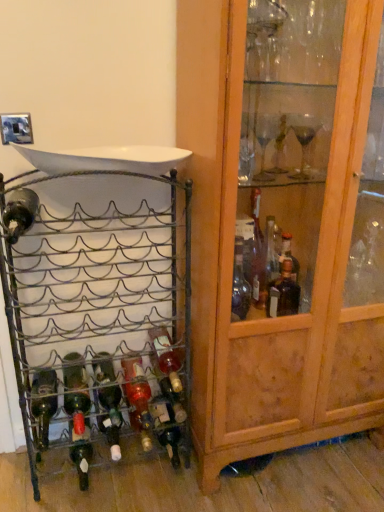
Question: From a real-world perspective, is wooden cabinet at right below metallic wire wine rack at left?

Choices:
 (A) yes
 (B) no

Answer: (B)

Question: Is wooden cabinet at right at the right side of metallic wire wine rack at left?

Choices:
 (A) no
 (B) yes

Answer: (B)

Question: Does wooden cabinet at right appear on the left side of metallic wire wine rack at left?

Choices:
 (A) no
 (B) yes

Answer: (A)

Question: Is wooden cabinet at right not close to metallic wire wine rack at left?

Choices:
 (A) no
 (B) yes

Answer: (A)

Question: Is wooden cabinet at right aimed at metallic wire wine rack at left?

Choices:
 (A) yes
 (B) no

Answer: (B)

Question: Does wooden cabinet at right touch metallic wire wine rack at left?

Choices:
 (A) no
 (B) yes

Answer: (A)

Question: Would you consider metallic wire wine rack at left to be distant from wooden cabinet at right?

Choices:
 (A) yes
 (B) no

Answer: (B)

Question: Is metallic wire wine rack at left at the left side of wooden cabinet at right?

Choices:
 (A) no
 (B) yes

Answer: (B)

Question: Considering the relative positions of metallic wire wine rack at left and wooden cabinet at right in the image provided, is metallic wire wine rack at left to the right of wooden cabinet at right from the viewer's perspective?

Choices:
 (A) no
 (B) yes

Answer: (A)

Question: Is metallic wire wine rack at left smaller than wooden cabinet at right?

Choices:
 (A) no
 (B) yes

Answer: (B)

Question: Is metallic wire wine rack at left positioned before wooden cabinet at right?

Choices:
 (A) yes
 (B) no

Answer: (B)

Question: From the image's perspective, is metallic wire wine rack at left beneath wooden cabinet at right?

Choices:
 (A) yes
 (B) no

Answer: (A)

Question: Does metallic wire wine rack at left have a greater width compared to green glass bottle at center, arranged as the third bottle when viewed from the right?

Choices:
 (A) yes
 (B) no

Answer: (B)